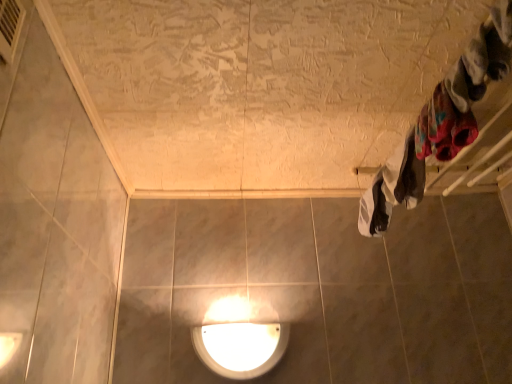
Locate an element on the screen. The height and width of the screenshot is (384, 512). white cotton towel at right, placed as the 3th clothing when sorted from top to bottom is located at coordinates (392, 188).

What is the approximate height of multicolored fabric at upper right, the 2th clothing when ordered from back to front?

The height of multicolored fabric at upper right, the 2th clothing when ordered from back to front, is 6.80 inches.

Describe the element at coordinates (238, 340) in the screenshot. I see `white glossy lamp at lower center` at that location.

The width and height of the screenshot is (512, 384). Identify the location of white glossy lamp at lower center. (238, 340).

Where is `metallic silver air conditioner at upper left`? metallic silver air conditioner at upper left is located at coordinates (10, 27).

This screenshot has height=384, width=512. I want to click on white cotton towel at right, marked as the third clothing in a front-to-back arrangement, so click(392, 188).

Can you confirm if multicolored fabric at upper right, which appears as the second clothing when ordered from the bottom, is thinner than fluffy white socks at upper right, positioned as the 1th clothing in front-to-back order?

Yes.

Is multicolored fabric at upper right, the 2th clothing from the top, oriented away from fluffy white socks at upper right, which is the 3th clothing in bottom-to-top order?

No.

Considering their positions, is multicolored fabric at upper right, marked as the second clothing in a front-to-back arrangement, located in front of or behind fluffy white socks at upper right, which is the 3th clothing from back to front?

Visually, multicolored fabric at upper right, marked as the second clothing in a front-to-back arrangement, is located behind fluffy white socks at upper right, which is the 3th clothing from back to front.

The width and height of the screenshot is (512, 384). Find the location of `clothing on the left of fluffy white socks at upper right, which is the 3th clothing from back to front`. clothing on the left of fluffy white socks at upper right, which is the 3th clothing from back to front is located at coordinates (443, 127).

How different are the orientations of metallic silver air conditioner at upper left and fluffy white socks at upper right, which is the 3th clothing in bottom-to-top order, in degrees?

They differ by 156 degrees in their facing directions.

From a real-world perspective, is metallic silver air conditioner at upper left positioned over fluffy white socks at upper right, which is the 1th clothing in top-to-bottom order, based on gravity?

Yes, from a real-world perspective, metallic silver air conditioner at upper left is on top of fluffy white socks at upper right, which is the 1th clothing in top-to-bottom order.

From the image's perspective, which one is positioned higher, metallic silver air conditioner at upper left or fluffy white socks at upper right, which is the 3th clothing in bottom-to-top order?

From the image's view, metallic silver air conditioner at upper left is above.

Is multicolored fabric at upper right, marked as the second clothing in a front-to-back arrangement, facing away from white cotton towel at right, marked as the third clothing in a front-to-back arrangement?

No, multicolored fabric at upper right, marked as the second clothing in a front-to-back arrangement,'s orientation is not away from white cotton towel at right, marked as the third clothing in a front-to-back arrangement.

From a real-world perspective, is multicolored fabric at upper right, marked as the second clothing in a front-to-back arrangement, under white cotton towel at right, placed as the 1th clothing when sorted from bottom to top?

Yes, from a real-world perspective, multicolored fabric at upper right, marked as the second clothing in a front-to-back arrangement, is under white cotton towel at right, placed as the 1th clothing when sorted from bottom to top.

From the image's perspective, which one is positioned lower, multicolored fabric at upper right, the 2th clothing when ordered from back to front, or white cotton towel at right, marked as the third clothing in a front-to-back arrangement?

white cotton towel at right, marked as the third clothing in a front-to-back arrangement, appears lower in the image.

Between white glossy lamp at lower center and multicolored fabric at upper right, the 2th clothing when ordered from back to front, which one appears on the right side from the viewer's perspective?

multicolored fabric at upper right, the 2th clothing when ordered from back to front, is more to the right.

From the image's perspective, is white glossy lamp at lower center over multicolored fabric at upper right, which appears as the second clothing when ordered from the bottom?

Actually, white glossy lamp at lower center appears below multicolored fabric at upper right, which appears as the second clothing when ordered from the bottom, in the image.

From the picture: Based on their sizes in the image, would you say white glossy lamp at lower center is bigger or smaller than multicolored fabric at upper right, marked as the second clothing in a front-to-back arrangement?

white glossy lamp at lower center is bigger than multicolored fabric at upper right, marked as the second clothing in a front-to-back arrangement.

In terms of height, does white glossy lamp at lower center look taller or shorter compared to white cotton towel at right, placed as the 3th clothing when sorted from top to bottom?

white glossy lamp at lower center is taller than white cotton towel at right, placed as the 3th clothing when sorted from top to bottom.

Considering the relative sizes of white glossy lamp at lower center and white cotton towel at right, placed as the 1th clothing when sorted from bottom to top, in the image provided, is white glossy lamp at lower center thinner than white cotton towel at right, placed as the 1th clothing when sorted from bottom to top,?

Yes, white glossy lamp at lower center is thinner than white cotton towel at right, placed as the 1th clothing when sorted from bottom to top.

Considering the relative sizes of white glossy lamp at lower center and white cotton towel at right, marked as the third clothing in a front-to-back arrangement, in the image provided, is white glossy lamp at lower center smaller than white cotton towel at right, marked as the third clothing in a front-to-back arrangement,?

Yes.

Is point (238, 362) closer to viewer compared to point (411, 130)?

No, (238, 362) is behind (411, 130).

Can you confirm if multicolored fabric at upper right, marked as the second clothing in a front-to-back arrangement, is taller than white glossy lamp at lower center?

No, multicolored fabric at upper right, marked as the second clothing in a front-to-back arrangement, is not taller than white glossy lamp at lower center.

From the image's perspective, is multicolored fabric at upper right, the 2th clothing from the top, on white glossy lamp at lower center?

Yes, from the image's perspective, multicolored fabric at upper right, the 2th clothing from the top, is above white glossy lamp at lower center.

Is multicolored fabric at upper right, the 2th clothing from the top, next to white glossy lamp at lower center and touching it?

No, multicolored fabric at upper right, the 2th clothing from the top, is not making contact with white glossy lamp at lower center.

Can you confirm if multicolored fabric at upper right, which appears as the second clothing when ordered from the bottom, is positioned to the right of white glossy lamp at lower center?

Indeed, multicolored fabric at upper right, which appears as the second clothing when ordered from the bottom, is positioned on the right side of white glossy lamp at lower center.

This screenshot has height=384, width=512. I want to click on lamp lying on the left of fluffy white socks at upper right, which is the 3th clothing from back to front, so click(x=238, y=340).

Is white glossy lamp at lower center looking in the opposite direction of fluffy white socks at upper right, which is the 3th clothing in bottom-to-top order?

No, white glossy lamp at lower center is not facing away from fluffy white socks at upper right, which is the 3th clothing in bottom-to-top order.

Could you measure the distance between white glossy lamp at lower center and fluffy white socks at upper right, which is the 3th clothing in bottom-to-top order?

white glossy lamp at lower center is 37.28 inches from fluffy white socks at upper right, which is the 3th clothing in bottom-to-top order.

From the image's perspective, is white glossy lamp at lower center on fluffy white socks at upper right, which is the 3th clothing from back to front?

No.

I want to click on clothing in front of the multicolored fabric at upper right, the 2th clothing from the top, so click(482, 58).

Locate an element on the screen. The image size is (512, 384). air conditioner that appears above the fluffy white socks at upper right, positioned as the 1th clothing in front-to-back order (from a real-world perspective) is located at coordinates 10,27.

Estimate the real-world distances between objects in this image. Which object is closer to metallic silver air conditioner at upper left, multicolored fabric at upper right, marked as the second clothing in a front-to-back arrangement, or white glossy lamp at lower center?

multicolored fabric at upper right, marked as the second clothing in a front-to-back arrangement, is closer to metallic silver air conditioner at upper left.

Estimate the real-world distances between objects in this image. Which object is further from multicolored fabric at upper right, which appears as the second clothing when ordered from the bottom, white cotton towel at right, placed as the 1th clothing when sorted from bottom to top, or white glossy lamp at lower center?

The object further to multicolored fabric at upper right, which appears as the second clothing when ordered from the bottom, is white glossy lamp at lower center.

Looking at the image, which one is located further to metallic silver air conditioner at upper left, white glossy lamp at lower center or multicolored fabric at upper right, the 2th clothing when ordered from back to front?

Among the two, white glossy lamp at lower center is located further to metallic silver air conditioner at upper left.

From the image, which object appears to be nearer to fluffy white socks at upper right, which is the 3th clothing from back to front, white cotton towel at right, marked as the third clothing in a front-to-back arrangement, or multicolored fabric at upper right, which appears as the second clothing when ordered from the bottom?

multicolored fabric at upper right, which appears as the second clothing when ordered from the bottom, lies closer to fluffy white socks at upper right, which is the 3th clothing from back to front, than the other object.

Based on their spatial positions, is metallic silver air conditioner at upper left or fluffy white socks at upper right, positioned as the 1th clothing in front-to-back order, closer to white glossy lamp at lower center?

The object closer to white glossy lamp at lower center is fluffy white socks at upper right, positioned as the 1th clothing in front-to-back order.

Considering their positions, is white cotton towel at right, placed as the 1th clothing when sorted from bottom to top, positioned closer to multicolored fabric at upper right, the 2th clothing when ordered from back to front, than metallic silver air conditioner at upper left?

The object closer to multicolored fabric at upper right, the 2th clothing when ordered from back to front, is white cotton towel at right, placed as the 1th clothing when sorted from bottom to top.

Which object lies nearer to the anchor point fluffy white socks at upper right, which is the 3th clothing in bottom-to-top order, white cotton towel at right, marked as the first clothing in a back-to-front arrangement, or metallic silver air conditioner at upper left?

The object closer to fluffy white socks at upper right, which is the 3th clothing in bottom-to-top order, is white cotton towel at right, marked as the first clothing in a back-to-front arrangement.

When comparing their distances from white cotton towel at right, marked as the first clothing in a back-to-front arrangement, does multicolored fabric at upper right, which appears as the second clothing when ordered from the bottom, or white glossy lamp at lower center seem closer?

multicolored fabric at upper right, which appears as the second clothing when ordered from the bottom, lies closer to white cotton towel at right, marked as the first clothing in a back-to-front arrangement, than the other object.

This screenshot has width=512, height=384. In order to click on clothing located between fluffy white socks at upper right, which is the 1th clothing in top-to-bottom order, and white cotton towel at right, placed as the 1th clothing when sorted from bottom to top, in the depth direction in this screenshot , I will do `click(443, 127)`.

In order to click on clothing that lies between multicolored fabric at upper right, the 2th clothing from the top, and white glossy lamp at lower center from top to bottom in this screenshot , I will do point(392,188).

Locate an element on the screen. clothing between metallic silver air conditioner at upper left and fluffy white socks at upper right, which is the 1th clothing in top-to-bottom order, in the horizontal direction is located at coordinates (443, 127).